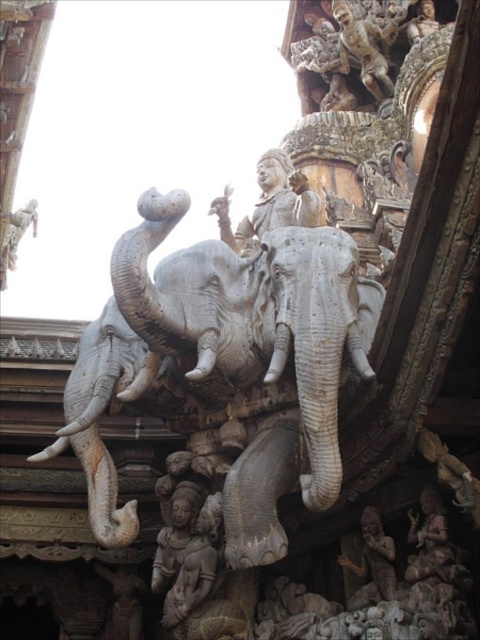
Who is lower down, gray stone elephant at left or carved stone statue at center?

carved stone statue at center is below.

Between gray stone elephant at left and carved stone statue at center, which one is positioned higher?

gray stone elephant at left is higher up.

The height and width of the screenshot is (640, 480). What do you see at coordinates (97, 419) in the screenshot? I see `gray stone elephant at left` at bounding box center [97, 419].

The width and height of the screenshot is (480, 640). In order to click on gray stone elephant at left in this screenshot , I will do `click(97, 419)`.

What do you see at coordinates (320, 337) in the screenshot? The height and width of the screenshot is (640, 480). I see `gray stone elephant at center` at bounding box center [320, 337].

Which is in front, point (282, 348) or point (203, 545)?

Positioned in front is point (282, 348).

Who is more forward, (351, 362) or (168, 556)?

Point (351, 362) is in front.

Locate an element on the screen. gray stone elephant at center is located at coordinates (320, 337).

This screenshot has width=480, height=640. Describe the element at coordinates (320, 337) in the screenshot. I see `gray stone elephant at center` at that location.

Is point (337, 237) in front of point (373, 593)?

No, (337, 237) is further to viewer.

Which is behind, point (359, 288) or point (355, 605)?

The point (359, 288) is more distant.

You are a GUI agent. You are given a task and a screenshot of the screen. Output one action in this format:
    pyautogui.click(x=<x>, y=<y>)
    Task: Click on the gray stone elephant at center
    
    Given the screenshot: What is the action you would take?
    pyautogui.click(x=320, y=337)